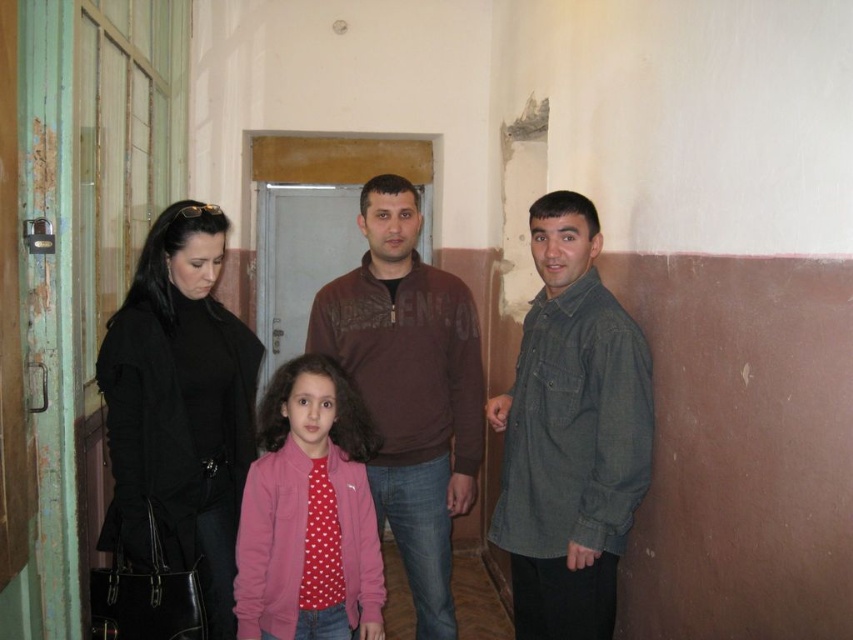
Question: Does dark green shirt at right have a greater width compared to black matte coat at left?

Choices:
 (A) no
 (B) yes

Answer: (B)

Question: Which object is the closest to the black matte coat at left?

Choices:
 (A) pink fleece jacket at center
 (B) dark green shirt at right

Answer: (A)

Question: Does black matte jacket at left appear on the left side of pink fleece jacket at center?

Choices:
 (A) no
 (B) yes

Answer: (A)

Question: In this image, where is dark green shirt at right located relative to pink fleece jacket at center?

Choices:
 (A) above
 (B) below

Answer: (A)

Question: Which object is closer to the camera taking this photo?

Choices:
 (A) pink fleece jacket at center
 (B) black matte coat at left

Answer: (B)

Question: Which is farther from the black matte jacket at left?

Choices:
 (A) dark green shirt at right
 (B) pink fleece jacket at center
 (C) black matte coat at left

Answer: (C)